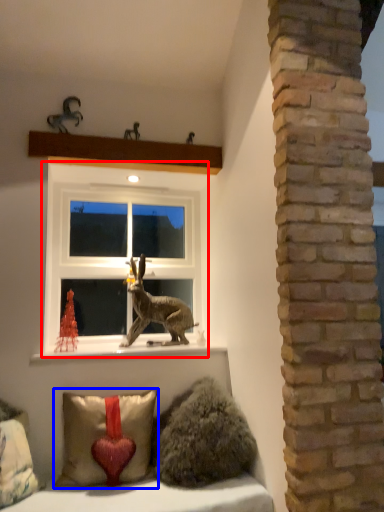
Question: Among these objects, which one is farthest to the camera, window (highlighted by a red box) or pillow (highlighted by a blue box)?

Choices:
 (A) window
 (B) pillow

Answer: (A)